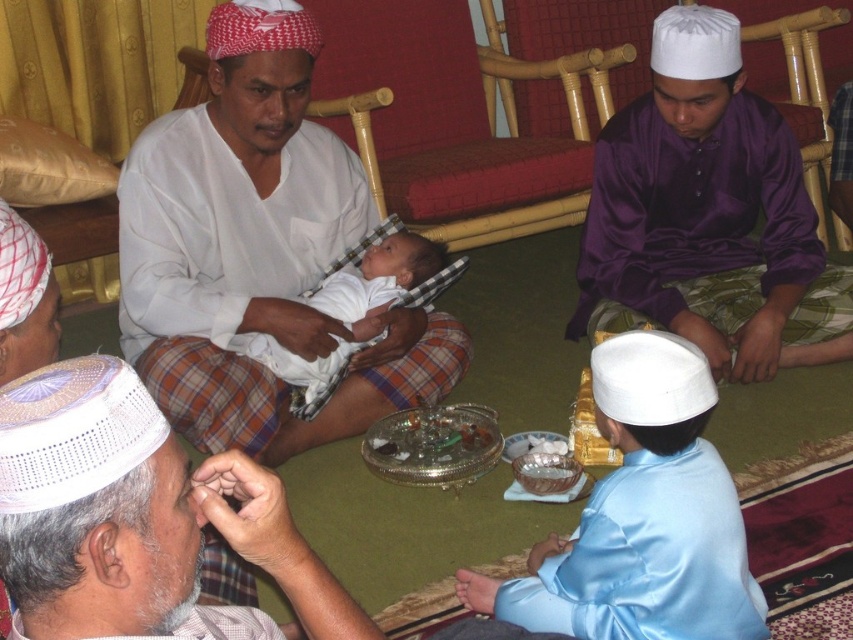
You are a photographer standing in the center of the room. You want to take a picture of the white woven cap at lower left and the light blue satin robe at lower right. Can you fit both items in your camera frame if your camera has a minimum required distance of 30 inches between objects to capture them both clearly?

The white woven cap at lower left and light blue satin robe at lower right are 31.71 inches apart from each other, which is more than the camera frame requirement of 30 inches. Therefore, both items can be captured clearly in the photo.

In the scene shown: You are a photographer trying to capture a clear shot of both the white woven cap at lower left and the light blue satin robe at lower right. Since you want both items to be visible in the frame, which object should you focus on first to ensure depth of field?

The white woven cap at lower left has a lesser height compared to light blue satin robe at lower right. To ensure both are in focus, you should focus on the closer object, which is the white woven cap at lower left, since it is nearer to the camera.

You are a photographer trying to capture a clear shot of the white matte shirt at center and the white woven cap at lower left. However, you notice that one object is blocking the view of the other. Which object is covering part of the other?

The white matte shirt at center is positioned over white woven cap at lower left, so the white matte shirt at center is covering part of the white woven cap at lower left.